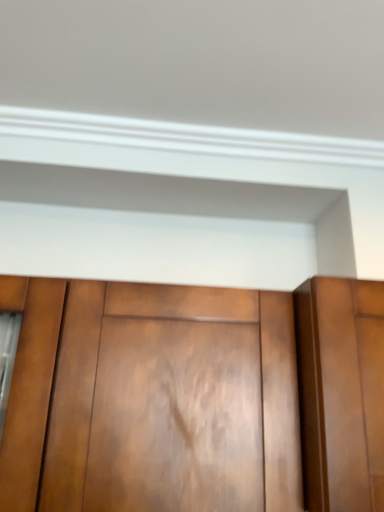
Question: Would you say shiny brown wood cupboard at center is part of glossy wood door at center's contents?

Choices:
 (A) yes
 (B) no

Answer: (B)

Question: Can you confirm if glossy wood door at center is smaller than shiny brown wood cupboard at center?

Choices:
 (A) yes
 (B) no

Answer: (A)

Question: From the image's perspective, is glossy wood door at center on shiny brown wood cupboard at center?

Choices:
 (A) yes
 (B) no

Answer: (A)

Question: From a real-world perspective, is glossy wood door at center located higher than shiny brown wood cupboard at center?

Choices:
 (A) no
 (B) yes

Answer: (B)

Question: Considering the relative positions of glossy wood door at center and shiny brown wood cupboard at center in the image provided, is glossy wood door at center to the right of shiny brown wood cupboard at center from the viewer's perspective?

Choices:
 (A) no
 (B) yes

Answer: (B)

Question: From a real-world perspective, is glossy wood door at center below shiny brown wood cupboard at center?

Choices:
 (A) yes
 (B) no

Answer: (B)

Question: Is shiny brown wood cupboard at center taller than glossy wood door at center?

Choices:
 (A) no
 (B) yes

Answer: (B)

Question: Can you confirm if shiny brown wood cupboard at center is positioned to the right of glossy wood door at center?

Choices:
 (A) no
 (B) yes

Answer: (A)

Question: Considering the relative positions of shiny brown wood cupboard at center and glossy wood door at center in the image provided, is shiny brown wood cupboard at center to the left of glossy wood door at center from the viewer's perspective?

Choices:
 (A) yes
 (B) no

Answer: (A)

Question: From the image's perspective, is shiny brown wood cupboard at center above glossy wood door at center?

Choices:
 (A) no
 (B) yes

Answer: (A)

Question: From a real-world perspective, is shiny brown wood cupboard at center located higher than glossy wood door at center?

Choices:
 (A) no
 (B) yes

Answer: (A)

Question: Is shiny brown wood cupboard at center facing towards glossy wood door at center?

Choices:
 (A) no
 (B) yes

Answer: (A)

Question: Is shiny brown wood cupboard at center bigger or smaller than glossy wood door at center?

Choices:
 (A) small
 (B) big

Answer: (B)